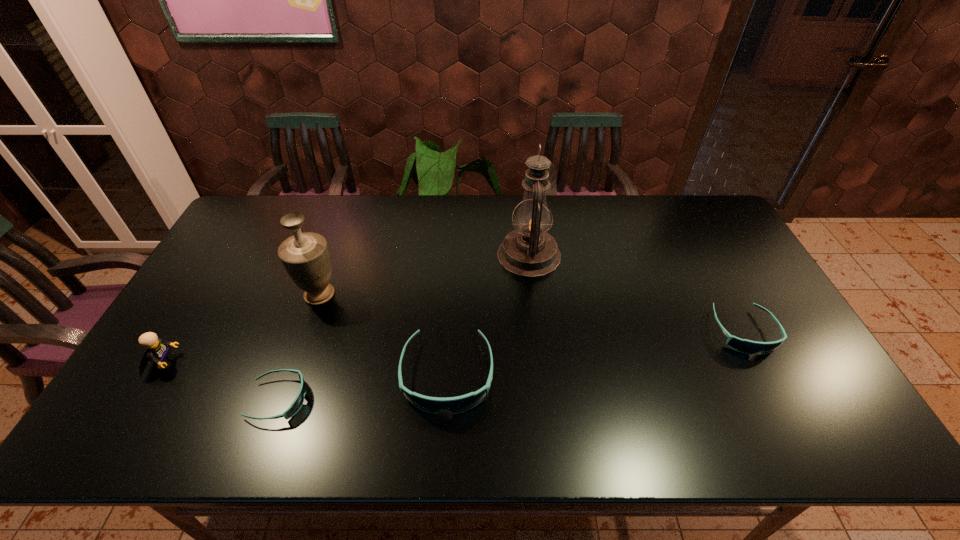
Where is `the leftmost sunglasses`? The height and width of the screenshot is (540, 960). the leftmost sunglasses is located at coordinates (298, 402).

Locate an element on the screen. the shortest sunglasses is located at coordinates (298, 402).

The image size is (960, 540). In order to click on the second sunglasses from right to left in this screenshot , I will do `click(454, 405)`.

You are a GUI agent. You are given a task and a screenshot of the screen. Output one action in this format:
    pyautogui.click(x=<x>, y=<y>)
    Task: Click on the third shortest object
    The height and width of the screenshot is (540, 960).
    Given the screenshot: What is the action you would take?
    pyautogui.click(x=454, y=405)

You are a GUI agent. You are given a task and a screenshot of the screen. Output one action in this format:
    pyautogui.click(x=<x>, y=<y>)
    Task: Click on the fifth tallest object
    This screenshot has height=540, width=960.
    Given the screenshot: What is the action you would take?
    [x=744, y=346]

Where is `the rightmost object`? the rightmost object is located at coordinates (744, 346).

Image resolution: width=960 pixels, height=540 pixels. I want to click on oil lamp, so click(529, 251).

Locate an element on the screen. The width and height of the screenshot is (960, 540). the fifth object from left to right is located at coordinates [x=529, y=251].

At what (x,y) coordinates should I click in order to perform the action: click on the leftmost object. Please return your answer as a coordinate pair (x, y). Looking at the image, I should click on (157, 351).

At what (x,y) coordinates should I click in order to perform the action: click on Lego. Please return your answer as a coordinate pair (x, y). Looking at the image, I should click on (157, 351).